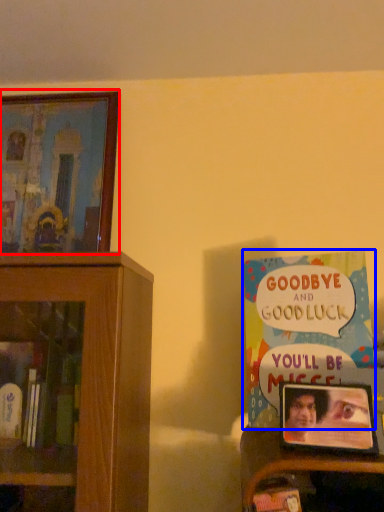
Question: Which object is further to the camera taking this photo, picture frame (highlighted by a red box) or book (highlighted by a blue box)?

Choices:
 (A) picture frame
 (B) book

Answer: (A)